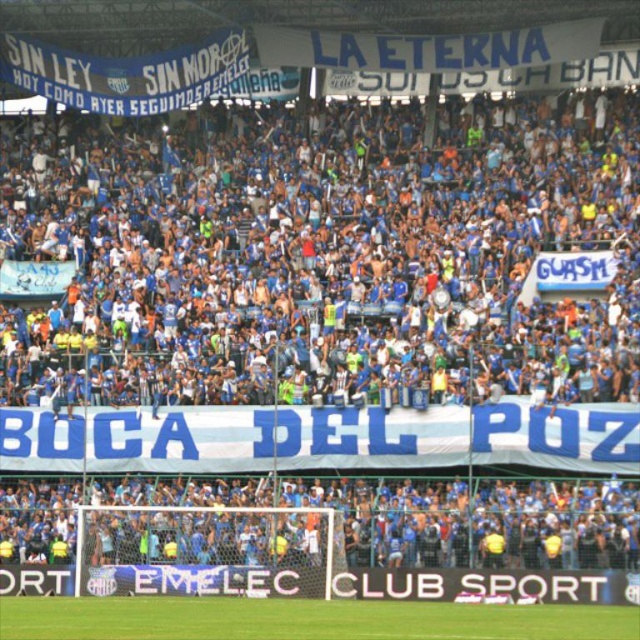
You are a photographer standing at the edge of the soccer stadium. You want to take a photo of the blue fabric banner at upper center and the blue jersey at lower center. Which object will appear larger in the photo?

The blue fabric banner at upper center will appear larger in the photo because it is much taller than the blue jersey at lower center.

You are a photographer standing at the edge of the soccer field. You want to take a photo that includes both the blue fabric banner at upper center and the blue jersey at lower center. Which object should you focus on first to ensure both are in the frame?

You should focus on the blue jersey at lower center first because the blue fabric banner at upper center is located above it, so adjusting the camera angle downward from the jersey will keep both in the frame.